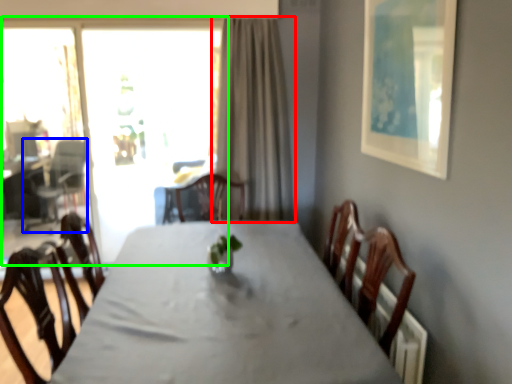
Question: Which is nearer to the curtain (highlighted by a red box)? armchair (highlighted by a blue box) or window (highlighted by a green box).

Choices:
 (A) armchair
 (B) window

Answer: (B)